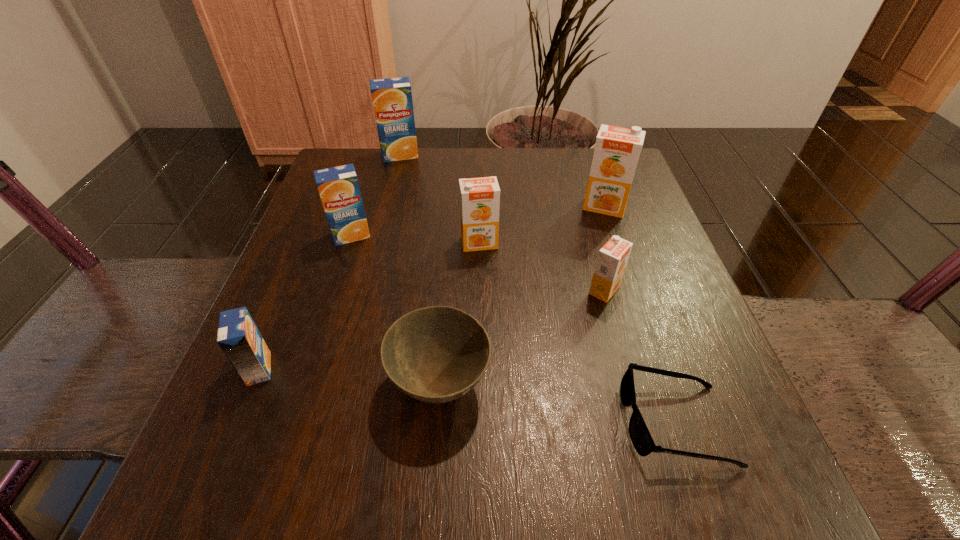
Locate an element on the screen. The width and height of the screenshot is (960, 540). the biggest blue orange_juice is located at coordinates (392, 98).

Identify the location of the farthest object. This screenshot has height=540, width=960. (392, 98).

Locate an element on the screen. the second farthest object is located at coordinates (617, 149).

The width and height of the screenshot is (960, 540). I want to click on the biggest orange orange juice, so click(x=617, y=149).

The width and height of the screenshot is (960, 540). In order to click on the second farthest blue orange_juice in this screenshot , I will do `click(339, 190)`.

The image size is (960, 540). I want to click on the leftmost orange orange juice, so click(x=479, y=197).

Where is `the second farthest orange orange juice`? This screenshot has height=540, width=960. the second farthest orange orange juice is located at coordinates (479, 197).

Locate an element on the screen. The image size is (960, 540). the leftmost orange juice is located at coordinates (239, 338).

Identify the location of the nearest orange juice. This screenshot has height=540, width=960. (239, 338).

You are a GUI agent. You are given a task and a screenshot of the screen. Output one action in this format:
    pyautogui.click(x=<x>, y=<y>)
    Task: Click on the nearest orange orange juice
    
    Given the screenshot: What is the action you would take?
    pyautogui.click(x=612, y=259)